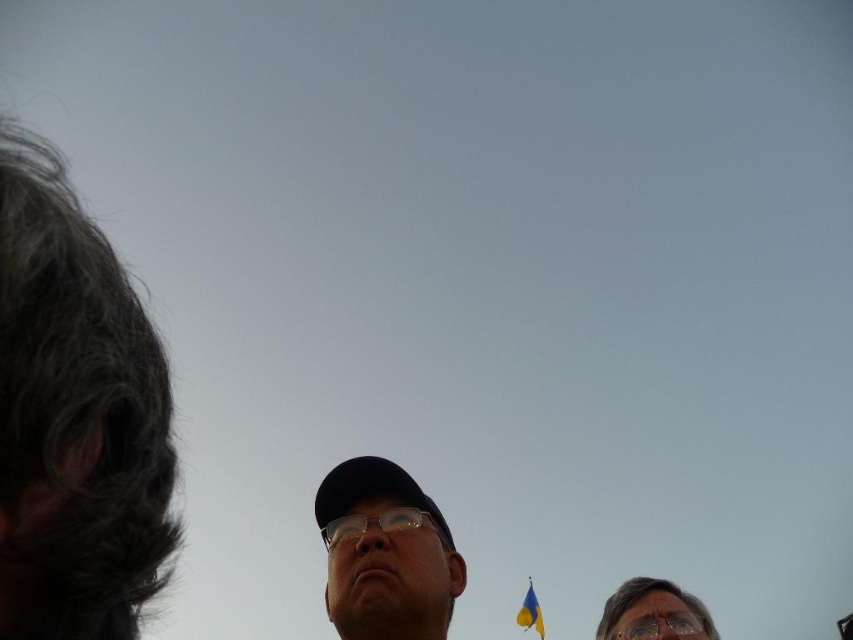
You are a photographer setting up equipment for an event. You have two items in your kit, the clear plastic glasses at lower right and the transparent plastic goggles at lower center. You need to place them on a shelf where vertical space is limited. Which item requires more vertical space?

The clear plastic glasses at lower right requires more vertical space because it has a greater height compared to the transparent plastic goggles at lower center.

You are a photographer who wants to capture a closeup of the clear plastic glasses at lower right without including the people in the image. Based on their positions, can you position yourself so that the people are out of the frame while still getting a clear shot of the glasses?

The clear plastic glasses at lower right is located at point (654, 612), so you can position yourself to the right and slightly behind the glasses to avoid including the people in the frame while focusing on them.

You are standing in a park and see the gray hair at left and the yellowpolyester fabricflag at lower center. Which object is located to the left of the other?

The gray hair at left is positioned on the left side of yellowpolyester fabricflag at lower center.